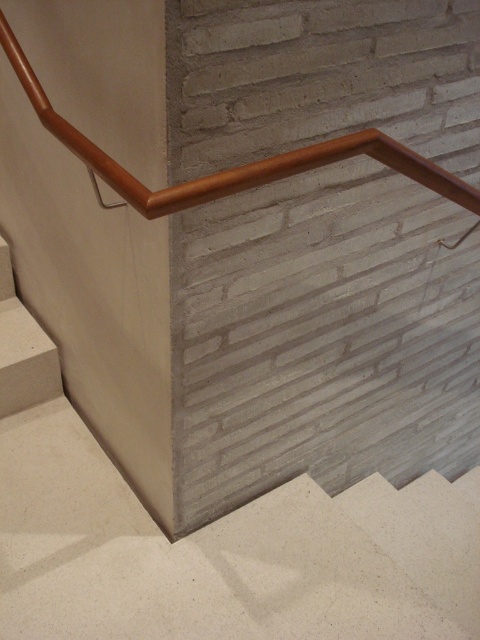
You are standing at the bottom of the staircase and want to grab the wooden handrail at upper center. Based on its position, which direction should you move to reach it?

The wooden handrail at upper center is located at point 0.264 on the x axis and 0.481 on the y axis. Since you are at the bottom, you need to move upwards along the y axis to reach it.

You are standing at the bottom of the staircase and want to hold the wooden handrail at upper center. Which direction should you move to reach it from the white concrete stair at lower left?

The wooden handrail at upper center is to the right of the white concrete stair at lower left, so you should move to your right to reach it.